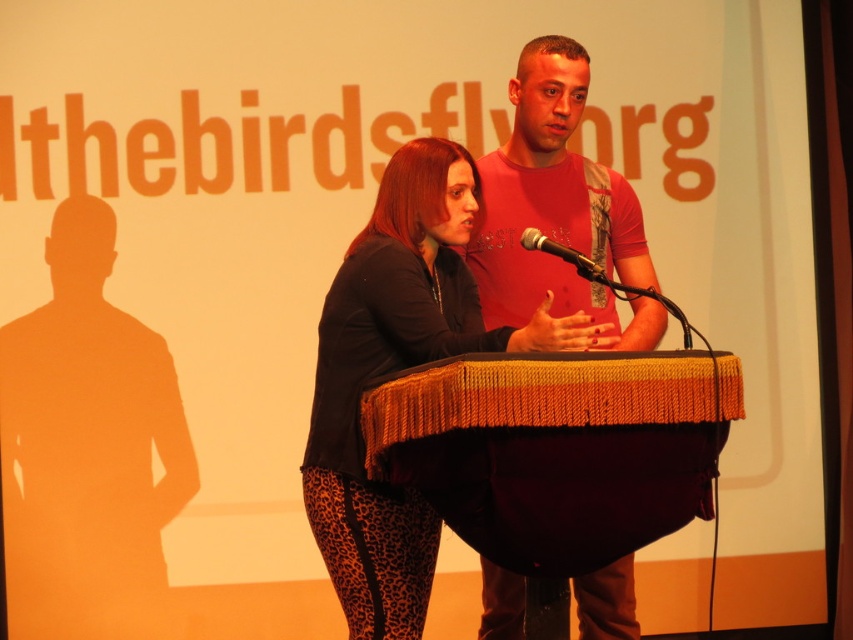
Measure the distance between black matte jacket at center and camera.

black matte jacket at center is 2.50 meters away from camera.

Is point (329, 288) farther from viewer compared to point (567, 260)?

Yes, it is behind point (567, 260).

Locate an element on the screen. The width and height of the screenshot is (853, 640). black matte jacket at center is located at coordinates (396, 371).

You are a GUI agent. You are given a task and a screenshot of the screen. Output one action in this format:
    pyautogui.click(x=<x>, y=<y>)
    Task: Click on the black matte jacket at center
    
    Given the screenshot: What is the action you would take?
    pyautogui.click(x=396, y=371)

Is point (508, 282) positioned in front of point (583, 262)?

No, (508, 282) is behind (583, 262).

Does matte red t-shirt at center have a lesser height compared to metallic silver microphone at center?

Incorrect, matte red t-shirt at center's height does not fall short of metallic silver microphone at center's.

Image resolution: width=853 pixels, height=640 pixels. Find the location of `matte red t-shirt at center`. matte red t-shirt at center is located at coordinates (558, 208).

Based on the photo, can you confirm if black matte jacket at center is bigger than matte red t-shirt at center?

Indeed, black matte jacket at center has a larger size compared to matte red t-shirt at center.

Looking at this image, who is more distant from viewer, (338,592) or (531,192)?

Positioned behind is point (531,192).

You are a GUI agent. You are given a task and a screenshot of the screen. Output one action in this format:
    pyautogui.click(x=<x>, y=<y>)
    Task: Click on the black matte jacket at center
    
    Given the screenshot: What is the action you would take?
    pyautogui.click(x=396, y=371)